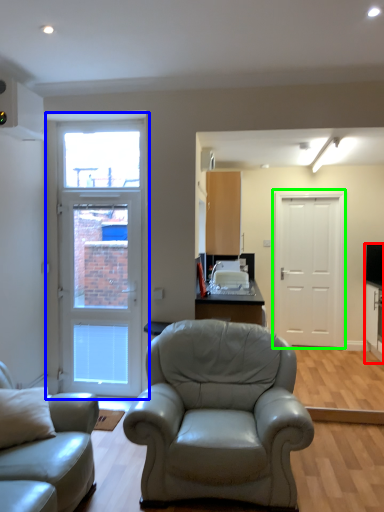
Question: Estimate the real-world distances between objects in this image. Which object is farther from entertainment center (highlighted by a red box), door (highlighted by a blue box) or door (highlighted by a green box)?

Choices:
 (A) door
 (B) door

Answer: (A)